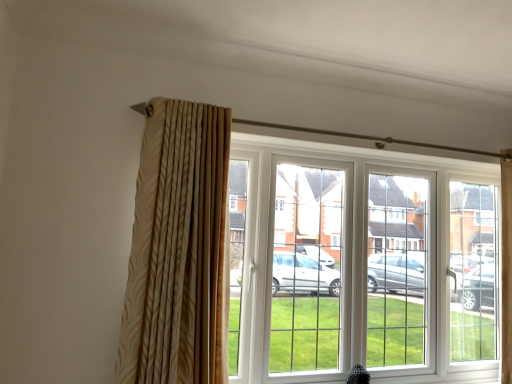
In order to face beige textured curtain at left, should I rotate leftwards or rightwards?

To align with it, rotate left about 9.989°.

This screenshot has width=512, height=384. I want to click on beige textured curtain at left, so click(178, 249).

Image resolution: width=512 pixels, height=384 pixels. Describe the element at coordinates (178, 249) in the screenshot. I see `beige textured curtain at left` at that location.

What is the approximate width of white plastic window at center?

The width of white plastic window at center is 11.12 inches.

The width and height of the screenshot is (512, 384). What do you see at coordinates (362, 263) in the screenshot?
I see `white plastic window at center` at bounding box center [362, 263].

Identify the location of white plastic window at center. (362, 263).

Find the location of a particular element. beige textured curtain at left is located at coordinates (178, 249).

Is white plastic window at center to the left or to the right of beige textured curtain at left in the image?

white plastic window at center is positioned on beige textured curtain at left's right side.

Considering the positions of objects white plastic window at center and beige textured curtain at left in the image provided, who is in front, white plastic window at center or beige textured curtain at left?

beige textured curtain at left.

Which is closer to the camera, (274, 300) or (168, 185)?

The point (168, 185) is closer to the camera.

From the image's perspective, which one is positioned higher, white plastic window at center or beige textured curtain at left?

beige textured curtain at left is shown above in the image.

From a real-world perspective, is white plastic window at center located beneath beige textured curtain at left?

Yes, from a real-world perspective, white plastic window at center is beneath beige textured curtain at left.

Is white plastic window at center thinner than beige textured curtain at left?

No, white plastic window at center is not thinner than beige textured curtain at left.

Which of these two, white plastic window at center or beige textured curtain at left, stands taller?

white plastic window at center is taller.

From the picture: Which of these two, white plastic window at center or beige textured curtain at left, is smaller?

With smaller size is beige textured curtain at left.

Could beige textured curtain at left be considered to be inside white plastic window at center?

No, beige textured curtain at left is not surrounded by white plastic window at center.

Is white plastic window at center far from beige textured curtain at left?

No.

Looking at this image, could you tell me if white plastic window at center is turned towards beige textured curtain at left?

No.

Identify the location of curtain on the left of white plastic window at center. This screenshot has height=384, width=512. (178, 249).

Visually, is beige textured curtain at left positioned to the left or to the right of white plastic window at center?

beige textured curtain at left is positioned on white plastic window at center's left side.

Relative to white plastic window at center, is beige textured curtain at left in front or behind?

Visually, beige textured curtain at left is located in front of white plastic window at center.

Is point (214, 259) positioned behind point (277, 338)?

No, it is in front of (277, 338).

From the image's perspective, which one is positioned higher, beige textured curtain at left or white plastic window at center?

beige textured curtain at left.

From a real-world perspective, is beige textured curtain at left located beneath white plastic window at center?

Incorrect, from a real-world perspective, beige textured curtain at left is higher than white plastic window at center.

From the picture: Considering the sizes of objects beige textured curtain at left and white plastic window at center in the image provided, who is thinner, beige textured curtain at left or white plastic window at center?

With smaller width is beige textured curtain at left.

Can you confirm if beige textured curtain at left is taller than white plastic window at center?

Incorrect, the height of beige textured curtain at left is not larger of that of white plastic window at center.

Based on the photo, considering the relative sizes of beige textured curtain at left and white plastic window at center in the image provided, is beige textured curtain at left smaller than white plastic window at center?

Indeed, beige textured curtain at left has a smaller size compared to white plastic window at center.

Would you say beige textured curtain at left is outside white plastic window at center?

Yes, beige textured curtain at left is outside of white plastic window at center.

Is beige textured curtain at left not close to white plastic window at center?

beige textured curtain at left is actually quite close to white plastic window at center.

Is beige textured curtain at left facing away from white plastic window at center?

No, beige textured curtain at left's orientation is not away from white plastic window at center.

The height and width of the screenshot is (384, 512). What are the coordinates of `window on the right of beige textured curtain at left` in the screenshot? It's located at (362, 263).

Locate an element on the screen. curtain that is above the white plastic window at center (from a real-world perspective) is located at coordinates (178, 249).

Image resolution: width=512 pixels, height=384 pixels. Find the location of `window to the right of beige textured curtain at left`. window to the right of beige textured curtain at left is located at coordinates (362, 263).